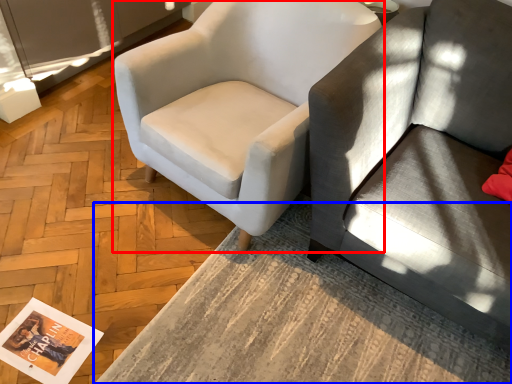
Question: Which object appears farthest to the camera in this image, chair (highlighted by a red box) or table (highlighted by a blue box)?

Choices:
 (A) chair
 (B) table

Answer: (A)